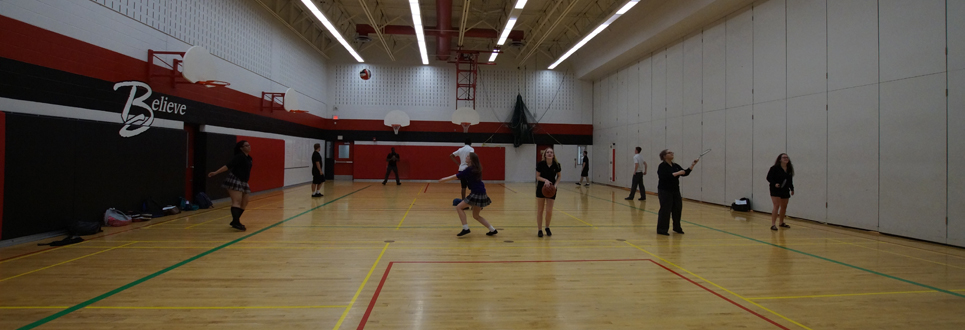
Where is `wall`? Image resolution: width=965 pixels, height=330 pixels. wall is located at coordinates (851, 106).